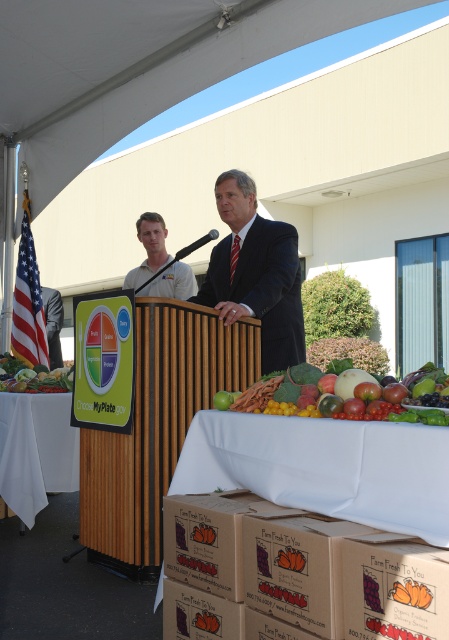
Does green leafy lettuce at center appear over white cloth-covered table at lower left?

Yes, green leafy lettuce at center is above white cloth-covered table at lower left.

This screenshot has height=640, width=449. What do you see at coordinates (343, 396) in the screenshot?
I see `green leafy lettuce at center` at bounding box center [343, 396].

Is point (337, 401) closer to viewer compared to point (40, 410)?

Yes, it is.

You are a GUI agent. You are given a task and a screenshot of the screen. Output one action in this format:
    pyautogui.click(x=<x>, y=<y>)
    Task: Click on the green leafy lettuce at center
    
    Given the screenshot: What is the action you would take?
    pyautogui.click(x=343, y=396)

Which is above, brown cardboard box at center or brown cardboard box at lower center?

Positioned higher is brown cardboard box at lower center.

Between point (311, 524) and point (174, 497), which one is positioned behind?

Point (174, 497)

Between point (303, 611) and point (221, 536), which one is positioned in front?

Positioned in front is point (303, 611).

Locate an element on the screen. The width and height of the screenshot is (449, 640). brown cardboard box at center is located at coordinates (296, 566).

Describe the element at coordinates (343, 396) in the screenshot. I see `green leafy lettuce at center` at that location.

This screenshot has width=449, height=640. What are the coordinates of `green leafy lettuce at center` in the screenshot? It's located at (343, 396).